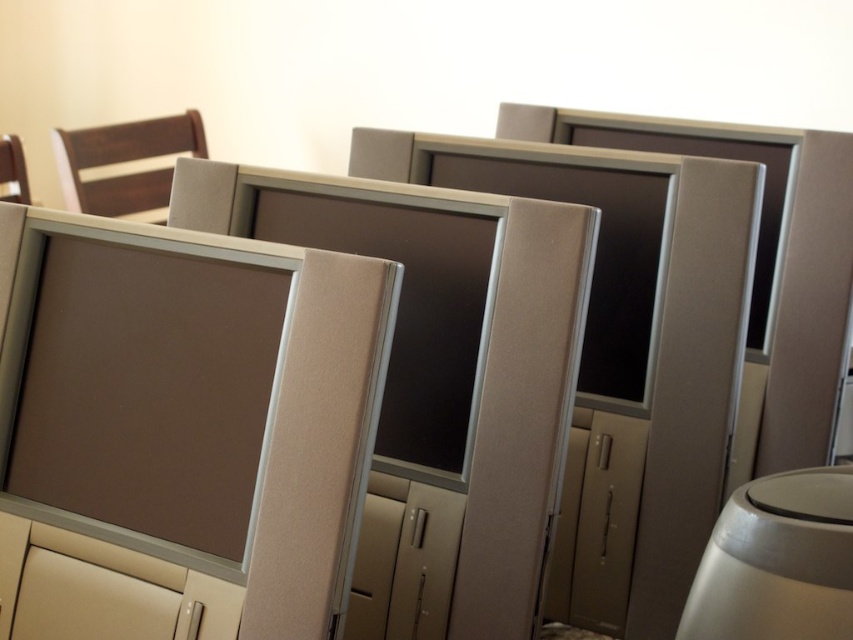
Looking at this image, you are an office worker who needs to adjust the height of your monitor to ensure comfortable viewing. The dark wood chair at upper left is your current seating. Can you lower the satin silver monitor at center to match the height of your chair?

The satin silver monitor at center is much taller than the dark wood chair at upper left, so you can lower the satin silver monitor at center to match the height of your chair.

You are an office worker who needs to place a new keyboard on your desk. The keyboard requires 20 cm of space. You see the satin silver monitor at center and the white glossy table at lower right. Which object can accommodate the keyboard?

The satin silver monitor at center is bigger than the white glossy table at lower right, so the white glossy table at lower right may not have enough space. However, the question mentions placing the keyboard on the desk, which is the white glossy table at lower right. Since the keyboard requires 20 cm of space, but the table is smaller than the monitor, it is unclear if the table has sufficient space. More information is needed.